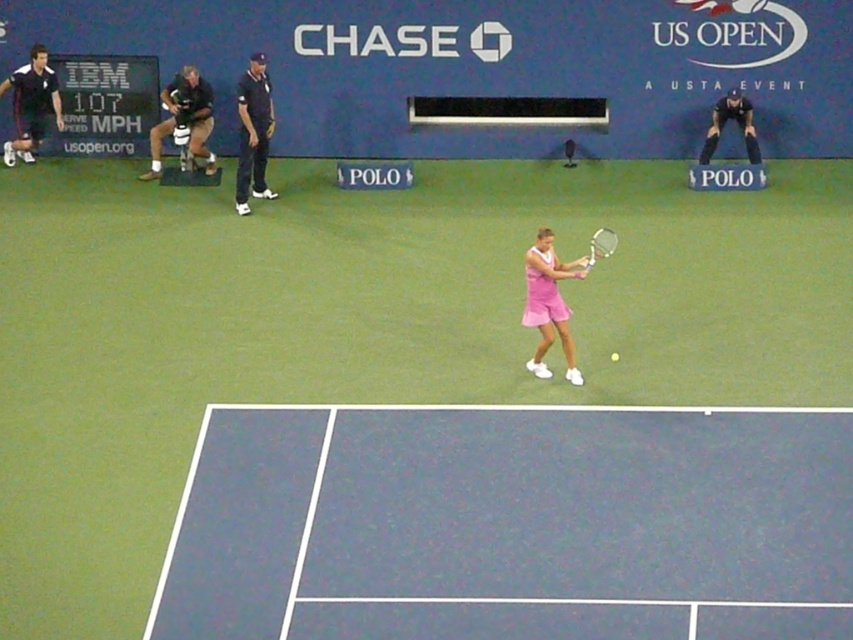
You are a tennis ball currently traveling towards the blue rubber tennis court at center during a match. There is a white plastic tennis racket at center in your path. Can you estimate whether the racket will reach you in time to hit you before you land on the court?

The blue rubber tennis court at center and white plastic tennis racket at center are 13.29 feet apart from each other. To determine if the racket will reach the ball in time, we need to consider the speed of the ball and the racket. However, since the distance is 13.29 feet and assuming average tennis speeds, the racket likely can reach the ball before it lands on the court.

You are a spectator standing at the edge of the blue rubber tennis court at center. You want to toss a tennis ball to the player who is currently hitting the ball. Considering the distance between you and the court, can you accurately throw the ball to the player without it going out of bounds?

The blue rubber tennis court at center is 25.99 feet away from viewer, so you can accurately throw the ball to the player as the distance is within a reasonable range for tossing a tennis ball without it going out of bounds.

You are a photographer at the US Open. You need to capture a photo where the blue rubber tennis court at center is visible above the pink fabric tennis outfit at center. Is this possible based on their sizes?

The blue rubber tennis court at center is shorter than the pink fabric tennis outfit at center, so it would not be possible to have the blue rubber tennis court at center appear above the pink fabric tennis outfit at center in the photo since the court is shorter.